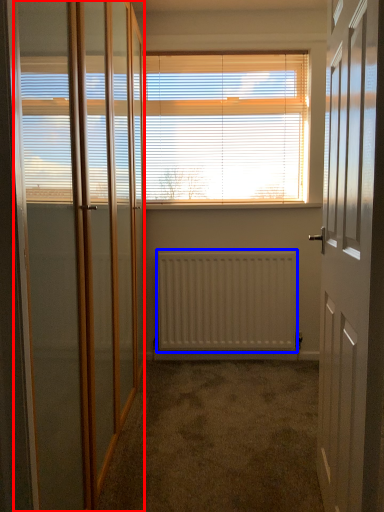
Question: Which object appears closest to the camera in this image, screen door (highlighted by a red box) or radiator (highlighted by a blue box)?

Choices:
 (A) screen door
 (B) radiator

Answer: (A)